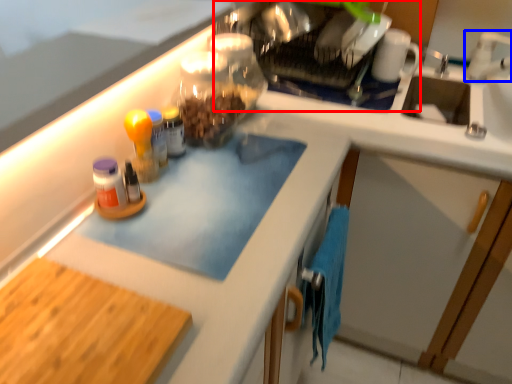
Question: Which point is closer to the camera, appliance (highlighted by a red box) or faucet (highlighted by a blue box)?

Choices:
 (A) appliance
 (B) faucet

Answer: (B)